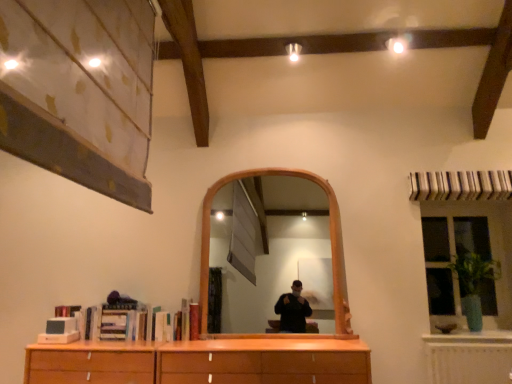
Describe the element at coordinates (451, 258) in the screenshot. The width and height of the screenshot is (512, 384). I see `green glass vase at right` at that location.

Locate an element on the screen. The image size is (512, 384). green glass vase at right is located at coordinates (451, 258).

Identify the location of green glossy vase at right. This screenshot has height=384, width=512. (473, 284).

This screenshot has width=512, height=384. What do you see at coordinates (473, 284) in the screenshot?
I see `green glossy vase at right` at bounding box center [473, 284].

You are a GUI agent. You are given a task and a screenshot of the screen. Output one action in this format:
    pyautogui.click(x=<x>, y=<y>)
    Task: Click on the green glass vase at right
    
    Given the screenshot: What is the action you would take?
    pyautogui.click(x=451, y=258)

Between green glass vase at right and green glossy vase at right, which one appears on the left side from the viewer's perspective?

green glossy vase at right is more to the left.

Which object is closer to the camera taking this photo, green glass vase at right or green glossy vase at right?

green glossy vase at right.

Considering the positions of points (492, 313) and (490, 275), is point (492, 313) farther from camera compared to point (490, 275)?

No, (492, 313) is in front of (490, 275).

From the image's perspective, is green glass vase at right located above or below green glossy vase at right?

→ green glass vase at right is above green glossy vase at right.

From a real-world perspective, is green glass vase at right on top of green glossy vase at right?

Yes, from a real-world perspective, green glass vase at right is on top of green glossy vase at right.

Looking at their sizes, would you say green glass vase at right is wider or thinner than green glossy vase at right?

Clearly, green glass vase at right has less width compared to green glossy vase at right.

Between green glass vase at right and green glossy vase at right, which one has more height?

green glass vase at right is taller.

Based on their sizes in the image, would you say green glass vase at right is bigger or smaller than green glossy vase at right?

green glass vase at right is bigger than green glossy vase at right.

Is green glass vase at right inside or outside of green glossy vase at right?

green glass vase at right cannot be found inside green glossy vase at right.

Is green glass vase at right positioned far away from green glossy vase at right?

No, green glass vase at right is in close proximity to green glossy vase at right.

Is green glass vase at right facing away from green glossy vase at right?

Yes, green glass vase at right is positioned with its back facing green glossy vase at right.

How far apart are green glass vase at right and green glossy vase at right?

6.91 inches.

You are a GUI agent. You are given a task and a screenshot of the screen. Output one action in this format:
    pyautogui.click(x=<x>, y=<y>)
    Task: Click on the window that is above the green glossy vase at right (from a real-world perspective)
    This screenshot has height=384, width=512.
    Given the screenshot: What is the action you would take?
    pyautogui.click(x=451, y=258)

Between green glossy vase at right and green glass vase at right, which one appears on the right side from the viewer's perspective?

green glass vase at right.

Is the depth of green glossy vase at right less than that of green glass vase at right?

Yes, the depth of green glossy vase at right is less than that of green glass vase at right.

Does point (472, 328) appear closer or farther from the camera than point (431, 225)?

Point (472, 328) appears to be closer to the viewer than point (431, 225).

From the image's perspective, is green glossy vase at right on green glass vase at right?

Incorrect, from the image's perspective, green glossy vase at right is lower than green glass vase at right.

From a real-world perspective, between green glossy vase at right and green glass vase at right, who is vertically higher?

green glass vase at right.

Looking at their sizes, would you say green glossy vase at right is wider or thinner than green glass vase at right?

In the image, green glossy vase at right appears to be wider than green glass vase at right.

Considering the relative sizes of green glossy vase at right and green glass vase at right in the image provided, is green glossy vase at right shorter than green glass vase at right?

Indeed, green glossy vase at right has a lesser height compared to green glass vase at right.

Looking at this image, does green glossy vase at right have a larger size compared to green glass vase at right?

No.

Consider the image. Choose the correct answer: Is green glossy vase at right inside green glass vase at right or outside it?

green glossy vase at right is spatially situated outside green glass vase at right.

Is green glossy vase at right directly adjacent to green glass vase at right?

green glossy vase at right and green glass vase at right are not in contact.

Is green glass vase at right at the back of green glossy vase at right?

Yes, green glass vase at right is at the back of green glossy vase at right.

Locate an element on the screen. The image size is (512, 384). window to the right of green glossy vase at right is located at coordinates (451, 258).

The width and height of the screenshot is (512, 384). What are the coordinates of `window that appears behind the green glossy vase at right` in the screenshot? It's located at (451, 258).

The image size is (512, 384). I want to click on plant on the left of green glass vase at right, so click(473, 284).